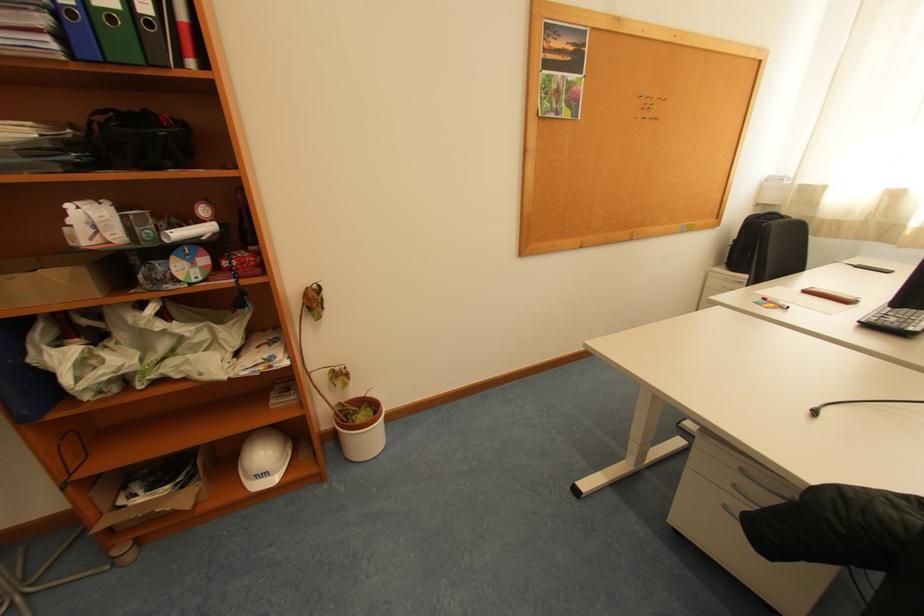
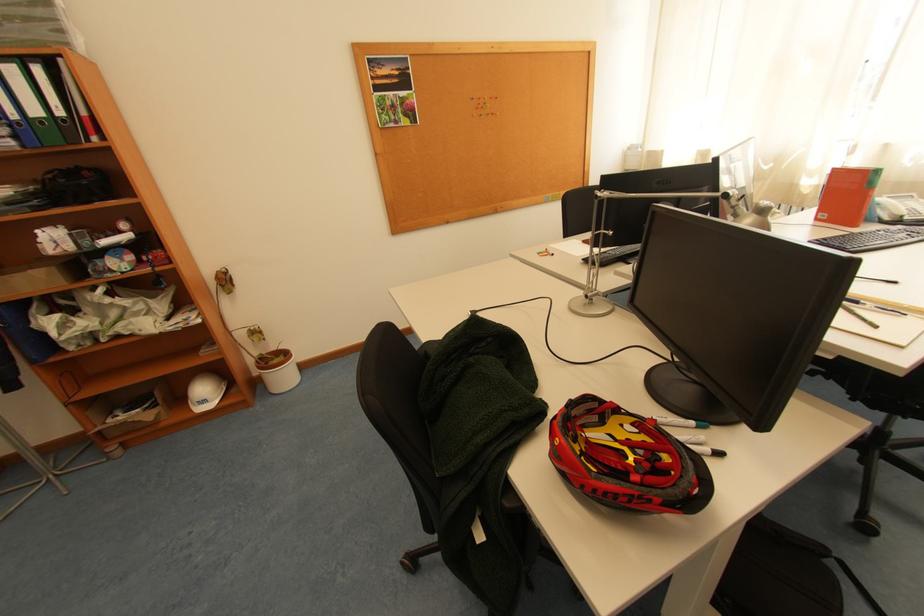
Where in the second image is the point corresponding to the point at 348,405 from the first image?

(270, 355)